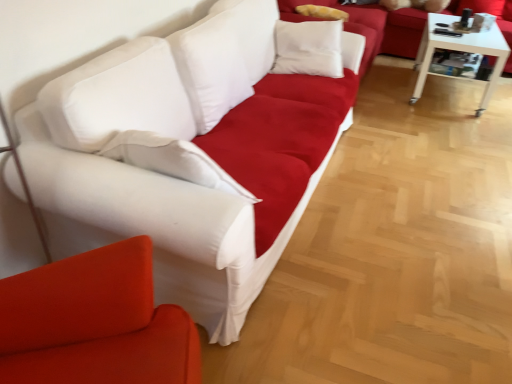
Question: From the image's perspective, is white fabric studio couch at upper center, the first studio couch viewed from the back, located above white fabric couch at center, positioned as the second studio couch in front-to-back order?

Choices:
 (A) no
 (B) yes

Answer: (B)

Question: Considering the relative sizes of white fabric studio couch at upper center, the first studio couch viewed from the back, and white fabric couch at center, positioned as the second studio couch in front-to-back order, in the image provided, is white fabric studio couch at upper center, the first studio couch viewed from the back, wider than white fabric couch at center, positioned as the second studio couch in front-to-back order,?

Choices:
 (A) yes
 (B) no

Answer: (A)

Question: Can you confirm if white fabric studio couch at upper center, which appears as the 3th studio couch when viewed from the front, is shorter than white fabric couch at center, the second studio couch when ordered from back to front?

Choices:
 (A) yes
 (B) no

Answer: (A)

Question: Is white fabric studio couch at upper center, which appears as the 3th studio couch when viewed from the front, oriented towards white fabric couch at center, positioned as the second studio couch in front-to-back order?

Choices:
 (A) no
 (B) yes

Answer: (A)

Question: Is white fabric studio couch at upper center, the first studio couch viewed from the back, outside of white fabric couch at center, the second studio couch when ordered from back to front?

Choices:
 (A) yes
 (B) no

Answer: (A)

Question: From a real-world perspective, is white fabric studio couch at upper center, which appears as the 3th studio couch when viewed from the front, located beneath white fabric couch at center, the second studio couch when ordered from back to front?

Choices:
 (A) no
 (B) yes

Answer: (B)

Question: From a real-world perspective, does white fabric couch at left, the 1th studio couch positioned from the front, stand above matte white couch at upper center?

Choices:
 (A) yes
 (B) no

Answer: (A)

Question: Is white fabric couch at left, which is the third studio couch from back to front, oriented towards matte white couch at upper center?

Choices:
 (A) yes
 (B) no

Answer: (B)

Question: Can you confirm if white fabric couch at left, which is the third studio couch from back to front, is thinner than matte white couch at upper center?

Choices:
 (A) no
 (B) yes

Answer: (B)

Question: Is the surface of white fabric couch at left, the 1th studio couch positioned from the front, in direct contact with matte white couch at upper center?

Choices:
 (A) no
 (B) yes

Answer: (A)

Question: Can you confirm if white fabric couch at left, the 1th studio couch positioned from the front, is smaller than matte white couch at upper center?

Choices:
 (A) yes
 (B) no

Answer: (A)

Question: Is white fabric couch at left, the 1th studio couch positioned from the front, surrounding matte white couch at upper center?

Choices:
 (A) no
 (B) yes

Answer: (A)

Question: Is matte white couch at upper center in contact with white glossy table at right?

Choices:
 (A) no
 (B) yes

Answer: (A)